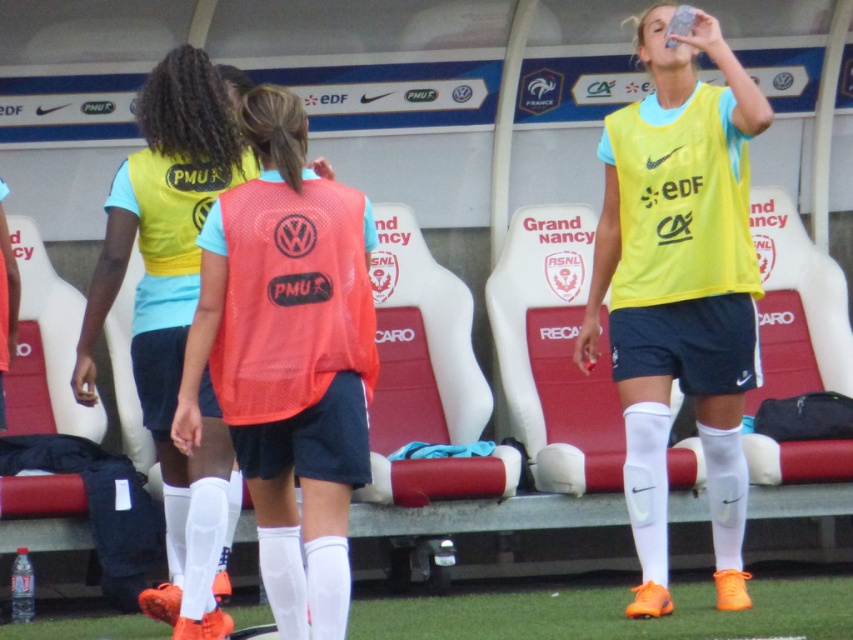
You are a photographer at the soccer dugout. You need to capture a photo of the yellow matte jersey at center and the clear plastic bottle at lower left. Which object will appear wider in the photo?

The yellow matte jersey at center will appear wider in the photo since its width surpasses that of the clear plastic bottle at lower left.

You are a photographer at the soccer field. You need to position a camera at the point marked by the coordinates point (173, 307). Which object will the camera be positioned at?

The camera positioned at point (173, 307) will be at the matte yellow vest at center.

You are a photographer standing at the edge of the dugout. You need to capture a photo of the yellow matte jersey at center and the matte yellow vest at center. Which object will appear taller in the photo?

The yellow matte jersey at center will appear taller in the photo because it has a greater height compared to the matte yellow vest at center.